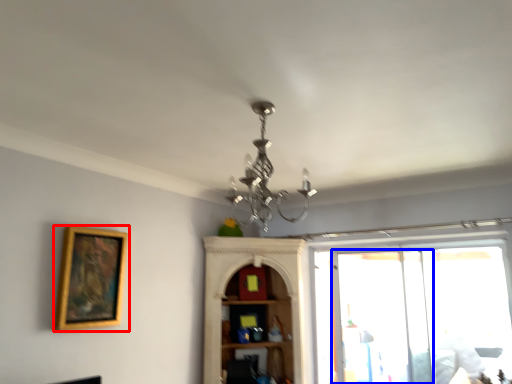
Question: Which point is closer to the camera, picture frame (highlighted by a red box) or screen door (highlighted by a blue box)?

Choices:
 (A) picture frame
 (B) screen door

Answer: (A)